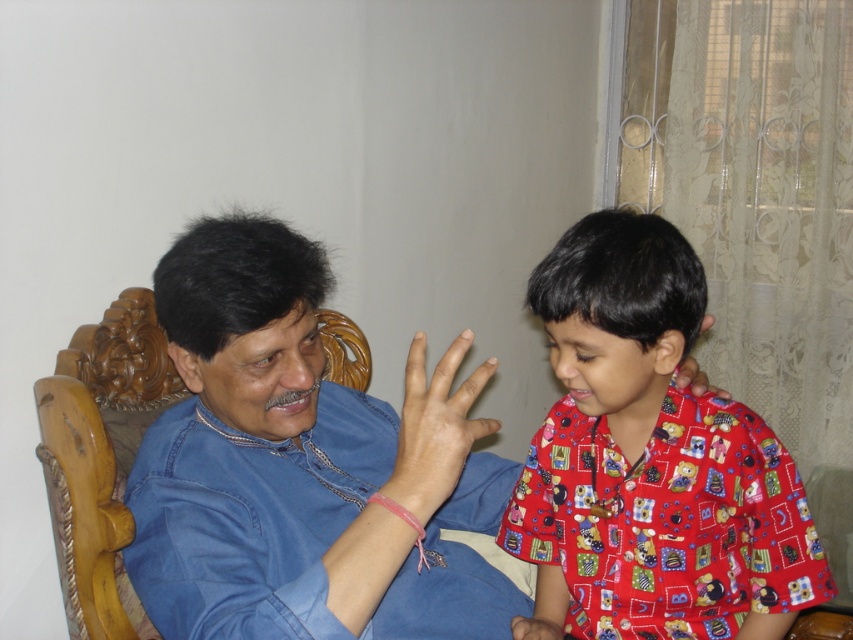
Question: Which object is farther from the camera taking this photo?

Choices:
 (A) printed cotton shirt at right
 (B) smooth skin hand at center

Answer: (A)

Question: Is blue denim shirt at center closer to camera compared to printed cotton shirt at right?

Choices:
 (A) yes
 (B) no

Answer: (A)

Question: Is printed cotton shirt at right above smooth skin hand at center?

Choices:
 (A) no
 (B) yes

Answer: (A)

Question: Which point is farther to the camera?

Choices:
 (A) (363, 563)
 (B) (432, 413)
 (C) (602, 362)

Answer: (C)

Question: Is blue denim shirt at center further to camera compared to smooth skin hand at center?

Choices:
 (A) yes
 (B) no

Answer: (B)

Question: Among these objects, which one is nearest to the camera?

Choices:
 (A) smooth skin hand at center
 (B) printed cotton shirt at right
 (C) blue denim shirt at center

Answer: (C)